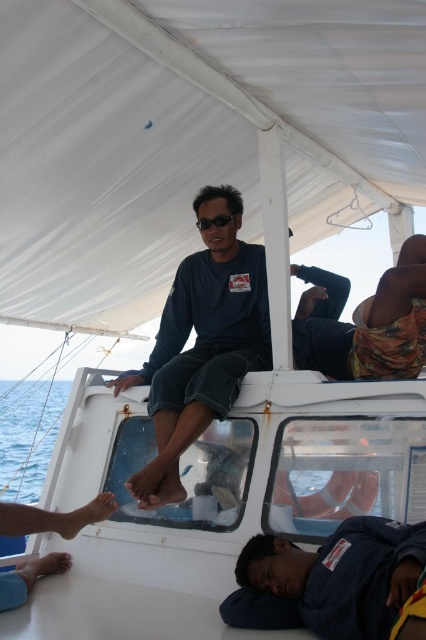
Can you confirm if transparent blue water at lower left is wider than black plastic goggles at upper center?

Indeed, transparent blue water at lower left has a greater width compared to black plastic goggles at upper center.

Does transparent blue water at lower left have a smaller size compared to black plastic goggles at upper center?

No.

Identify the location of transparent blue water at lower left. The width and height of the screenshot is (426, 640). (250, 460).

Does dark blue fabric at lower right appear over camouflage fabric shirt at center?

Actually, dark blue fabric at lower right is below camouflage fabric shirt at center.

This screenshot has height=640, width=426. Describe the element at coordinates (330, 580) in the screenshot. I see `dark blue fabric at lower right` at that location.

Is point (333, 557) closer to viewer compared to point (402, 244)?

Yes.

You are a GUI agent. You are given a task and a screenshot of the screen. Output one action in this format:
    pyautogui.click(x=<x>, y=<y>)
    Task: Click on the dark blue fabric at lower right
    
    Given the screenshot: What is the action you would take?
    pyautogui.click(x=330, y=580)

Based on the photo, does camouflage fabric shirt at center appear on the left side of blue water at lower left?

In fact, camouflage fabric shirt at center is to the right of blue water at lower left.

Is point (399, 298) farther from camera compared to point (14, 474)?

No.

Does point (402, 314) come farther from viewer compared to point (5, 396)?

No, it is in front of (5, 396).

Locate an element on the screen. The image size is (426, 640). camouflage fabric shirt at center is located at coordinates [368, 324].